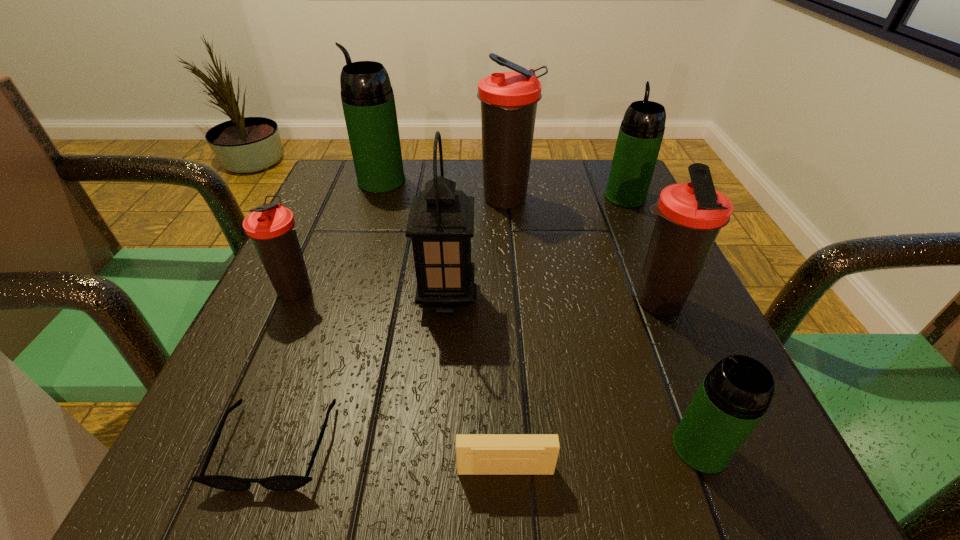
Identify the location of the second brown thermos bottle from left to right. (509, 100).

Locate an element on the screen. This screenshot has width=960, height=540. the third thermos bottle from left to right is located at coordinates (509, 100).

The height and width of the screenshot is (540, 960). Identify the location of the biggest green thermos bottle. (367, 97).

I want to click on black lantern, so click(441, 221).

Image resolution: width=960 pixels, height=540 pixels. What are the coordinates of `the second smallest green thermos bottle` in the screenshot? It's located at (641, 132).

Find the location of a particular element. the rightmost brown thermos bottle is located at coordinates (690, 215).

Locate an element on the screen. The height and width of the screenshot is (540, 960). the smallest brown thermos bottle is located at coordinates (271, 227).

Where is `the nearest thermos bottle`? The height and width of the screenshot is (540, 960). the nearest thermos bottle is located at coordinates 734,396.

Where is `the smallest green thermos bottle`? the smallest green thermos bottle is located at coordinates (734, 396).

This screenshot has width=960, height=540. Find the location of `beige videotape`. beige videotape is located at coordinates (476, 454).